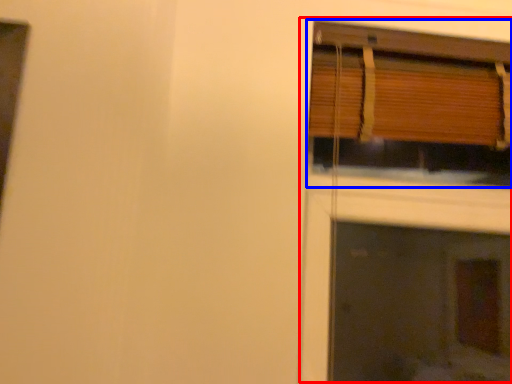
Question: Which object is further to the camera taking this photo, fireplace (highlighted by a red box) or window (highlighted by a blue box)?

Choices:
 (A) fireplace
 (B) window

Answer: (A)